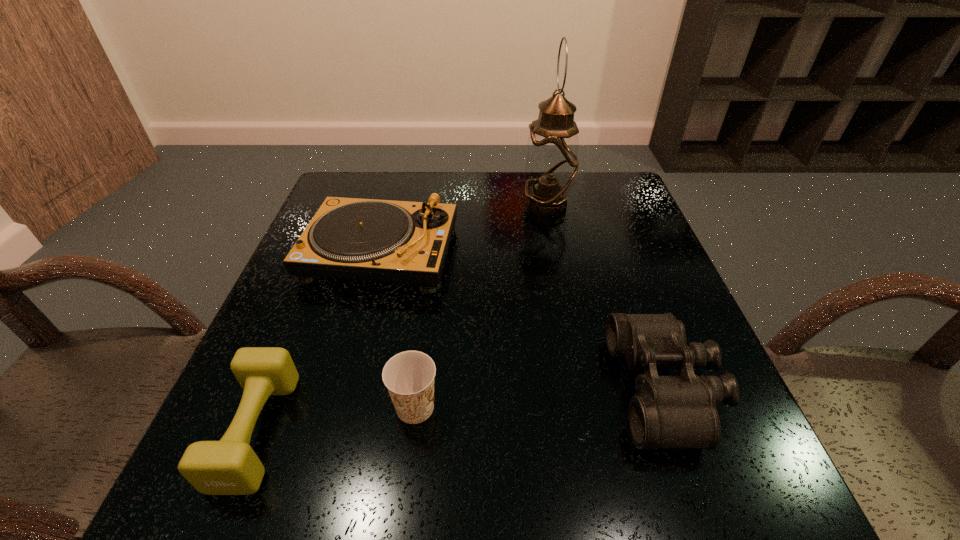
I want to click on object present at the near left corner, so click(230, 466).

This screenshot has height=540, width=960. I want to click on object at the near right corner, so click(x=680, y=411).

This screenshot has width=960, height=540. Find the location of `vacant area at the far edge of the desktop`. vacant area at the far edge of the desktop is located at coordinates (435, 178).

At what (x,y) coordinates should I click in order to perform the action: click on vacant space at the near edge of the desktop. Please return your answer as a coordinate pair (x, y). The image size is (960, 540). Looking at the image, I should click on (438, 462).

Image resolution: width=960 pixels, height=540 pixels. Find the location of `vacant space at the left edge of the desktop`. vacant space at the left edge of the desktop is located at coordinates (270, 445).

Find the location of a particular element. vacant space at the right edge of the desktop is located at coordinates (613, 226).

Where is `blank space at the far left corner`? blank space at the far left corner is located at coordinates (351, 187).

Find the location of a particular element. vacant space at the far right corner of the desktop is located at coordinates (639, 212).

Locate an element on the screen. vacant region at the near right corner of the desktop is located at coordinates (673, 488).

You are a GUI agent. You are given a task and a screenshot of the screen. Output one action in this format:
    pyautogui.click(x=<x>, y=<y>)
    Task: Click on the empty space between the oil lamp and the dumbbell
    Image resolution: width=960 pixels, height=540 pixels.
    Given the screenshot: What is the action you would take?
    pyautogui.click(x=401, y=318)